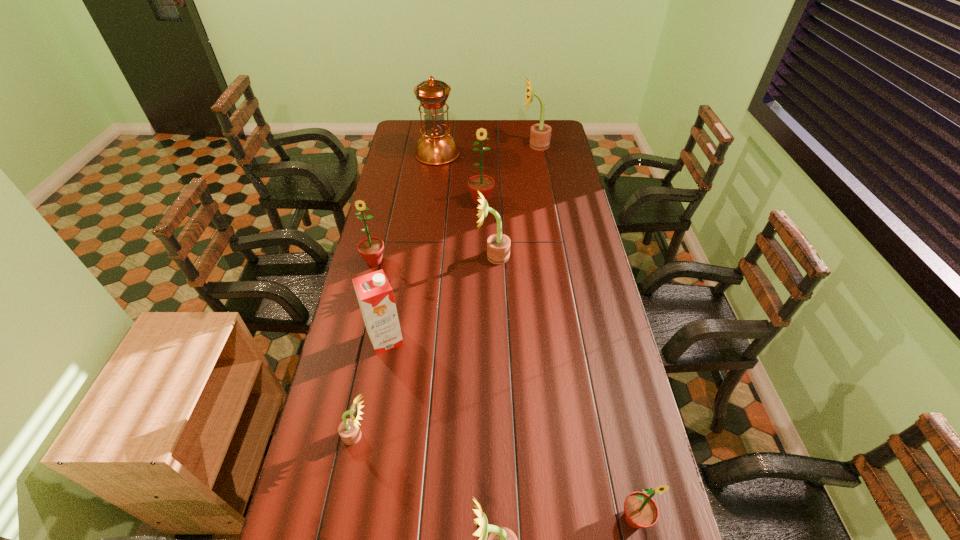
Where is `the smallest green sunflower`? The width and height of the screenshot is (960, 540). the smallest green sunflower is located at coordinates (641, 511).

Locate an element on the screen. Image resolution: width=960 pixels, height=540 pixels. the leftmost yellow sunflower is located at coordinates (349, 431).

Identify the location of the seventh farthest object. This screenshot has height=540, width=960. (349, 431).

Where is `vacant area located on the right of the oil lamp`? vacant area located on the right of the oil lamp is located at coordinates (489, 154).

Where is `free region located on the face of the farthest yellow sunflower`? The height and width of the screenshot is (540, 960). free region located on the face of the farthest yellow sunflower is located at coordinates (503, 145).

Locate an element on the screen. free space located on the face of the farthest yellow sunflower is located at coordinates (499, 145).

Where is `vacant region located 0.160m on the face of the farthest yellow sunflower`? Image resolution: width=960 pixels, height=540 pixels. vacant region located 0.160m on the face of the farthest yellow sunflower is located at coordinates (490, 145).

Identify the location of vacant space located 0.400m on the face of the farthest green sunflower. The image size is (960, 540). (481, 274).

This screenshot has height=540, width=960. Find the location of `free space located on the face of the second farthest yellow sunflower`. free space located on the face of the second farthest yellow sunflower is located at coordinates (416, 256).

You are a GUI agent. You are given a task and a screenshot of the screen. Output one action in this format:
    pyautogui.click(x=<x>, y=<y>)
    Task: Click on the free space located on the face of the second farthest yellow sunflower
    The image size is (960, 540).
    Given the screenshot: What is the action you would take?
    pyautogui.click(x=454, y=256)